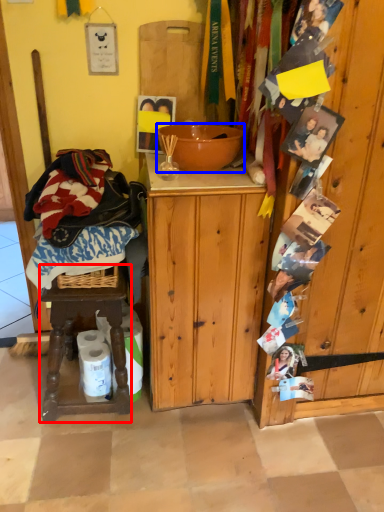
Question: Which object is further to the camera taking this photo, stool (highlighted by a red box) or bowl (highlighted by a blue box)?

Choices:
 (A) stool
 (B) bowl

Answer: (A)